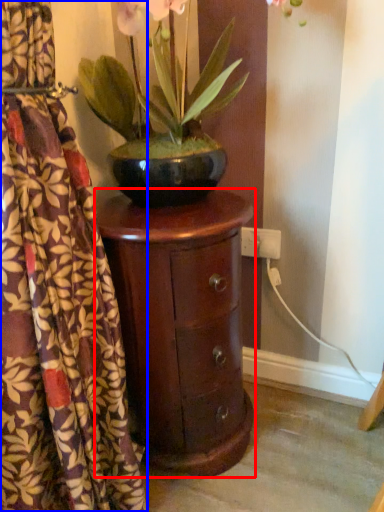
Question: Which object is further to the camera taking this photo, nightstand (highlighted by a red box) or curtain (highlighted by a blue box)?

Choices:
 (A) nightstand
 (B) curtain

Answer: (A)